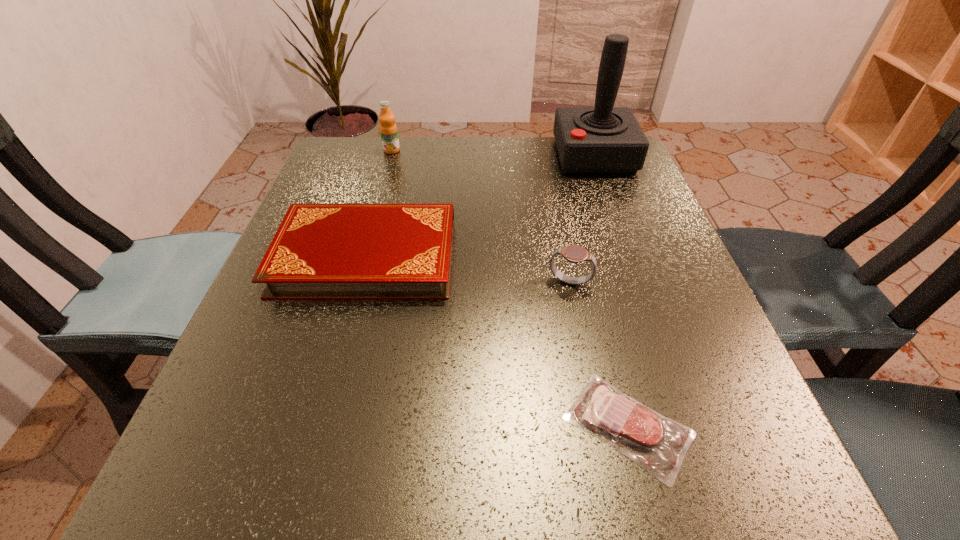
Find the location of a particular element. This screenshot has width=960, height=540. vacant area that lies between the third shortest object and the tallest object is located at coordinates (582, 219).

Find the location of `free point between the third shortest object and the second shortest object`. free point between the third shortest object and the second shortest object is located at coordinates (468, 269).

Find the location of a particular element. free space between the hardback book and the joystick is located at coordinates (480, 206).

The width and height of the screenshot is (960, 540). I want to click on vacant space in between the tallest object and the fourth tallest object, so click(480, 206).

This screenshot has width=960, height=540. What are the coordinates of `free spot between the steak and the orange juice` in the screenshot? It's located at (510, 288).

At what (x,y) coordinates should I click in order to perform the action: click on empty space that is in between the third shortest object and the joystick. Please return your answer as a coordinate pair (x, y). The width and height of the screenshot is (960, 540). Looking at the image, I should click on tap(582, 219).

At what (x,y) coordinates should I click in order to perform the action: click on empty space between the watch and the hardback book. Please return your answer as a coordinate pair (x, y). Looking at the image, I should click on (468, 269).

This screenshot has width=960, height=540. I want to click on vacant area that lies between the third tallest object and the orange juice, so click(x=481, y=217).

The width and height of the screenshot is (960, 540). Identify the location of free space that is in between the second shortest object and the orange juice. (379, 204).

Identify the location of object that is the closest to the watch. (658, 444).